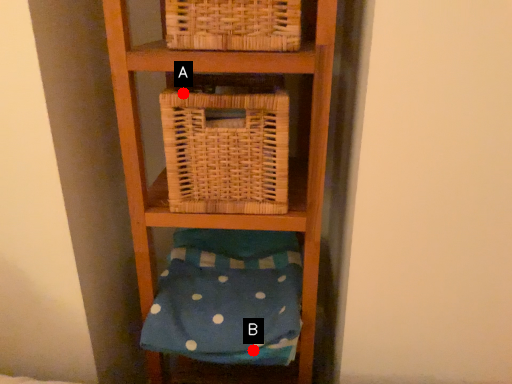
Question: Two points are circled on the image, labeled by A and B beside each circle. Which point appears closest to the camera in this image?

Choices:
 (A) A is closer
 (B) B is closer

Answer: (A)